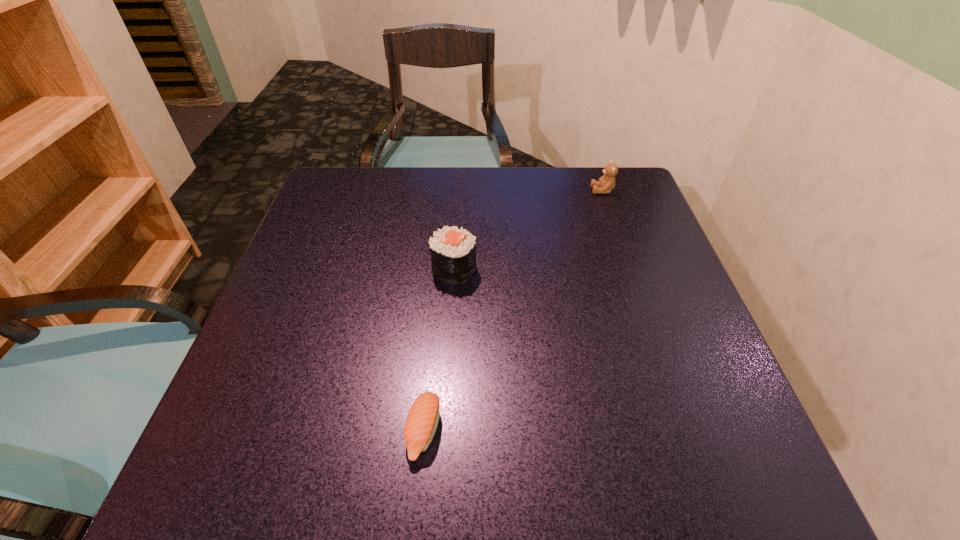
At what (x,y) coordinates should I click in order to perform the action: click on free spot between the shorter sushi and the teddy bear. Please return your answer as a coordinate pair (x, y). The image size is (960, 540). Looking at the image, I should click on (513, 311).

At what (x,y) coordinates should I click in order to perform the action: click on object that ranks as the second closest to the teddy bear. Please return your answer as a coordinate pair (x, y). Looking at the image, I should click on (422, 420).

Identify which object is the closest to the shorter sushi. Please provide its 2D coordinates. Your answer should be formatted as a tuple, i.e. [(x, y)], where the tuple contains the x and y coordinates of a point satisfying the conditions above.

[(453, 251)]

At what (x,y) coordinates should I click in order to perform the action: click on free space that satisfies the following two spatial constraints: 1. on the front-facing side of the rightmost object; 2. on the front side of the nearest object. Please return your answer as a coordinate pair (x, y). This screenshot has height=540, width=960. Looking at the image, I should click on (685, 431).

Where is `vacant space that satisfies the following two spatial constraints: 1. on the back side of the farther sushi; 2. on the right side of the nearest object`? The image size is (960, 540). vacant space that satisfies the following two spatial constraints: 1. on the back side of the farther sushi; 2. on the right side of the nearest object is located at coordinates (439, 269).